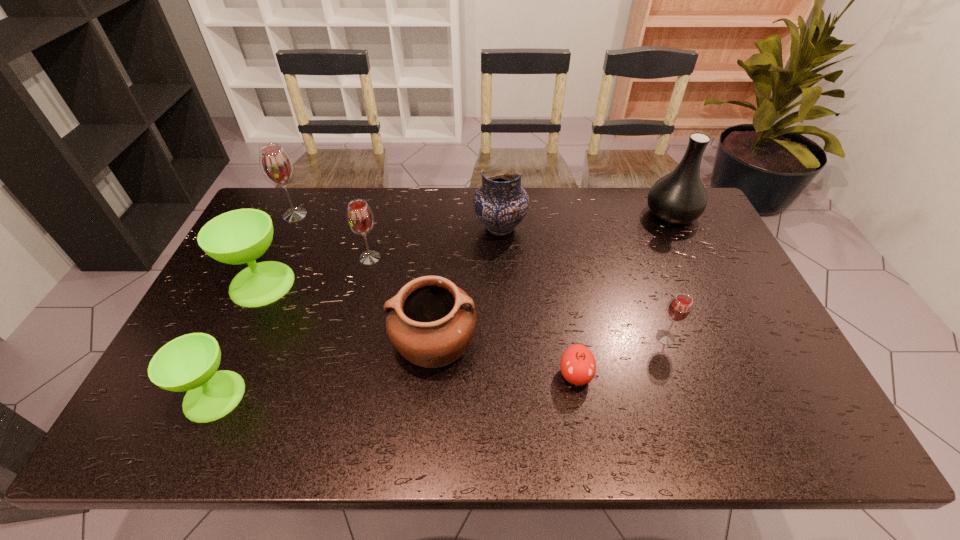
This screenshot has height=540, width=960. I want to click on vase, so click(x=679, y=197).

This screenshot has height=540, width=960. I want to click on the farthest wineglass, so click(x=276, y=165).

Locate an element on the screen. The width and height of the screenshot is (960, 540). the tallest wineglass is located at coordinates (276, 165).

This screenshot has height=540, width=960. Identify the location of the farther pottery. coord(501,203).

You are a GUI agent. You are given a task and a screenshot of the screen. Output one action in this format:
    pyautogui.click(x=<x>, y=<y>)
    Task: Click on the blue pottery
    
    Given the screenshot: What is the action you would take?
    pyautogui.click(x=501, y=203)

The width and height of the screenshot is (960, 540). Identify the location of the sixth object from right to left. (360, 218).

Locate an element on the screen. The height and width of the screenshot is (540, 960). the second red wineglass from right to left is located at coordinates (360, 218).

At what (x,y) coordinates should I click in order to perform the action: click on the bigger green wineglass. Please return your answer as a coordinate pair (x, y). Looking at the image, I should click on (240, 236).

At what (x,y) coordinates should I click in order to perform the action: click on reddish pottery. Please return your answer as a coordinate pair (x, y). Looking at the image, I should click on (430, 321).

Identify the location of the nearer pottery. The height and width of the screenshot is (540, 960). (430, 321).